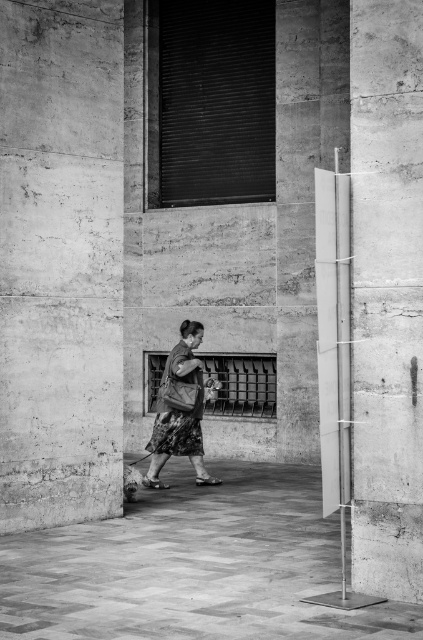
You are standing at the center of the room and see the point marked at coordinates (x=60, y=260). What object is located at that point?

The point at coordinates (x=60, y=260) marks the location of the smooth concrete pillar at left.

You are an architect designing a new space. You need to place a 1.2 meter wide sculpture between the concrete pillar at right and the floral skirt at center. Is there enough space?

The concrete pillar at right is thinner than the floral skirt at center, but without specific measurements of their positions, it is impossible to determine if there is enough space for the 1.2 meter wide sculpture between them.

Based on the scene described, which of the two pillars, the smooth concrete pillar at left or the concrete pillar at right, is taller?

The concrete pillar at right is taller than the smooth concrete pillar at left according to the description.